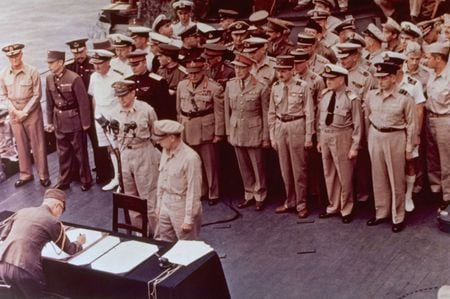
Identify the location of table. The width and height of the screenshot is (450, 299). (142, 276).